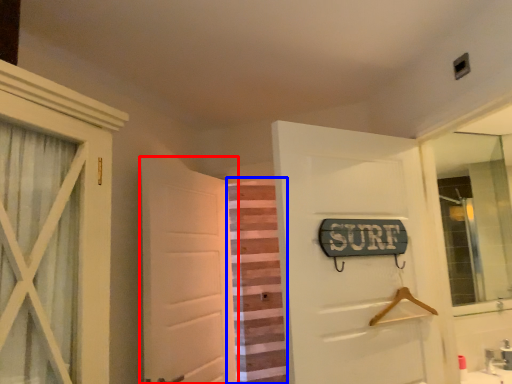
Question: Among these objects, which one is nearest to the camera, door (highlighted by a red box) or curtain (highlighted by a blue box)?

Choices:
 (A) door
 (B) curtain

Answer: (A)